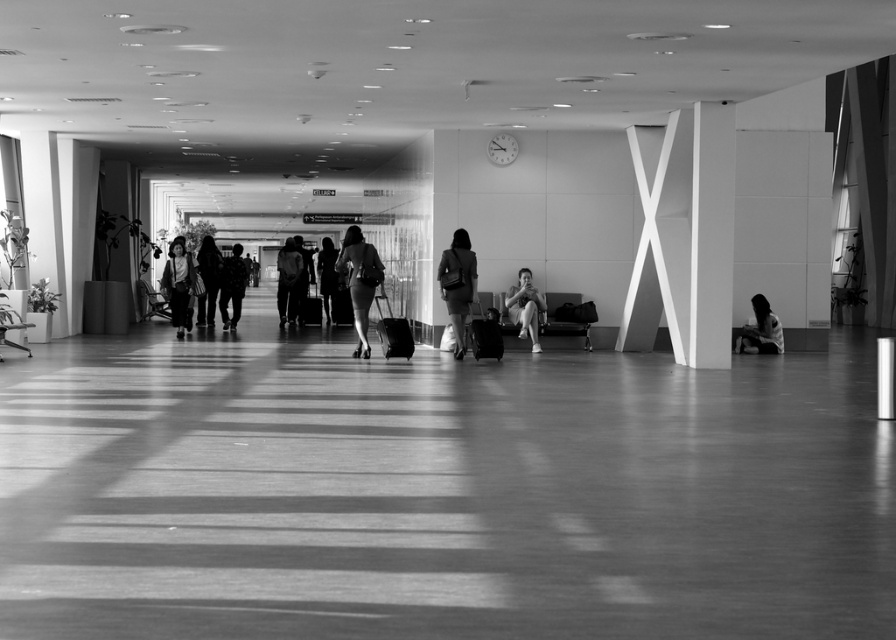
Is matte black jacket at left below silhouette fabric dress at center?

A: Yes, matte black jacket at left is below silhouette fabric dress at center.

Find the location of a particular element. The image size is (896, 640). matte black jacket at left is located at coordinates (179, 285).

Image resolution: width=896 pixels, height=640 pixels. I want to click on matte black jacket at left, so click(179, 285).

Does dark fabric bag at center lie behind silhouette fabric dress at center?

Yes, it is.

Is dark fabric bag at center smaller than silhouette fabric dress at center?

Yes.

Identify the location of dark fabric bag at center. This screenshot has width=896, height=640. (208, 280).

Can you confirm if matte black dress at center is smaller than matte black suitcase at center?

Yes.

Does point (376, 282) come closer to viewer compared to point (293, 291)?

Yes, it is.

Locate an element on the screen. This screenshot has width=896, height=640. matte black dress at center is located at coordinates (360, 282).